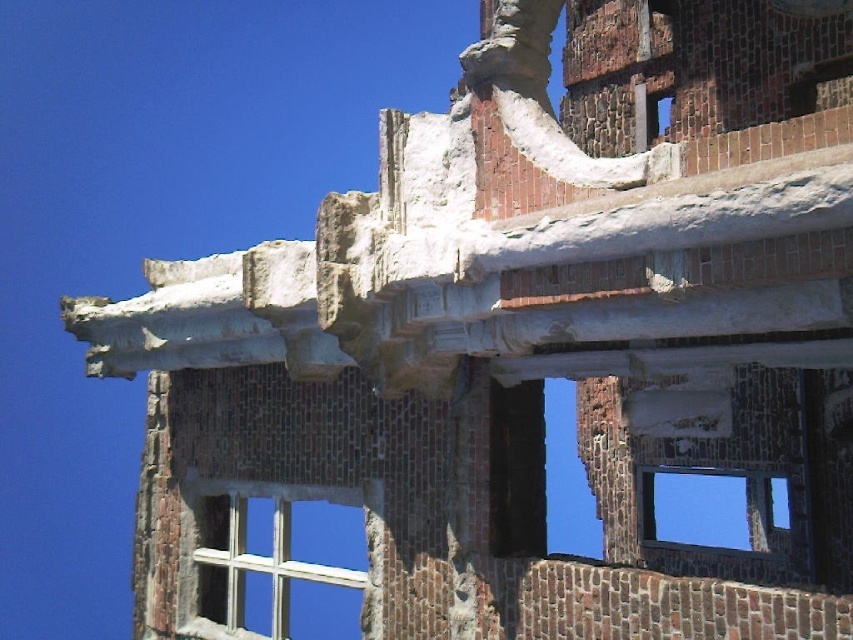
Can you confirm if white wooden window at center is bigger than transparent glass window at center?

Actually, white wooden window at center might be smaller than transparent glass window at center.

Who is more forward, (x=206, y=488) or (x=660, y=500)?

Point (x=206, y=488) is more forward.

Who is more distant from viewer, (254, 493) or (781, 490)?

The point (781, 490) is behind.

Find the location of a particular element. white wooden window at center is located at coordinates (256, 554).